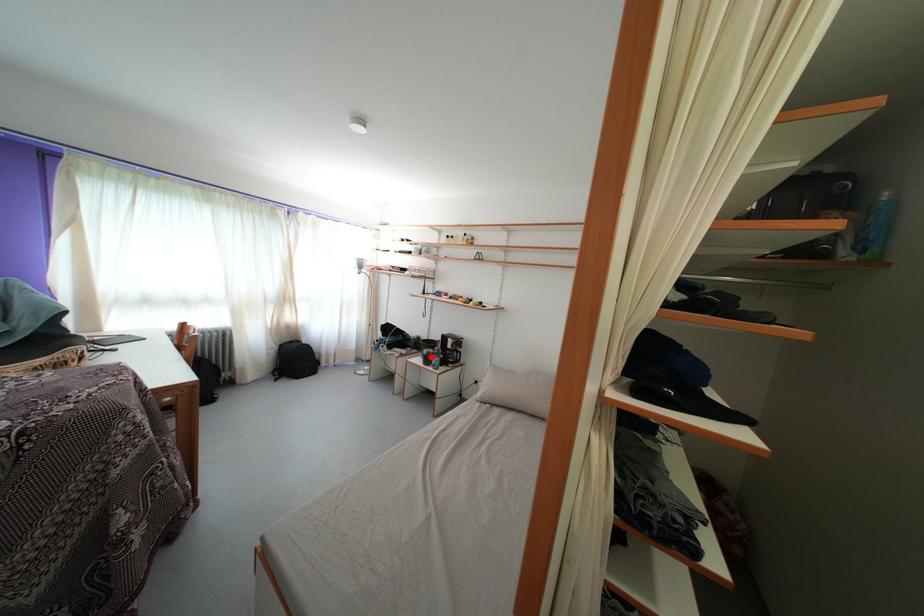
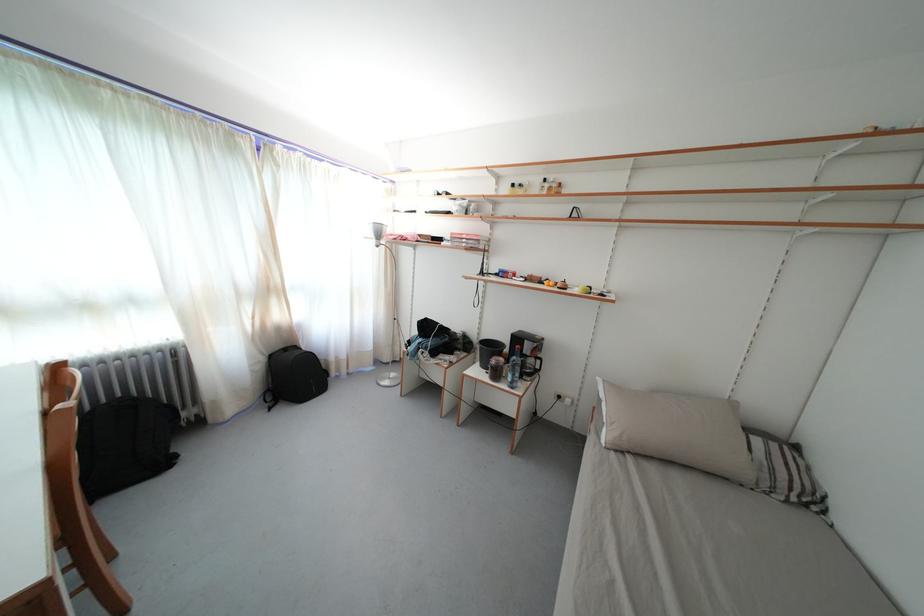
In the second image, find the point that corresponds to the highlighted location in the first image.

(499, 367)